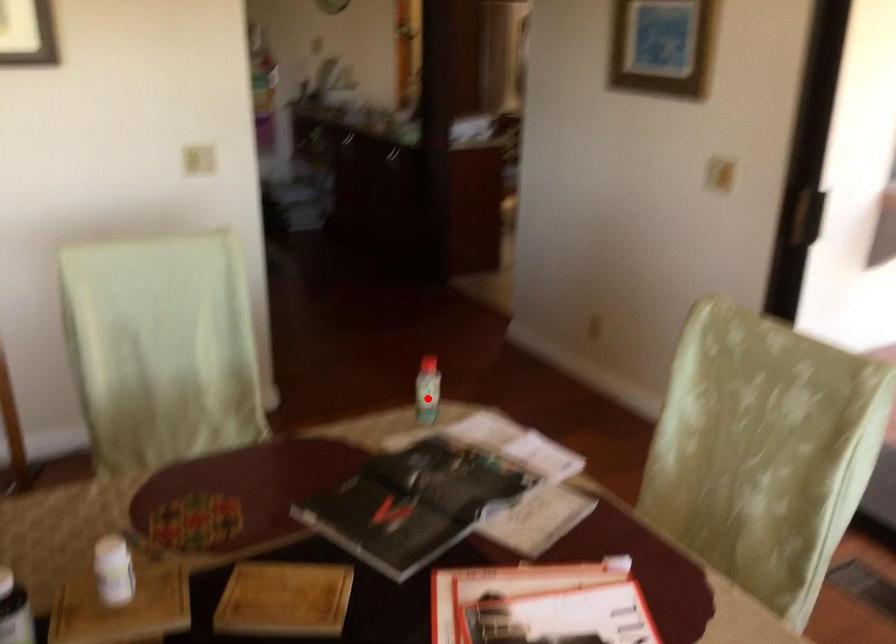
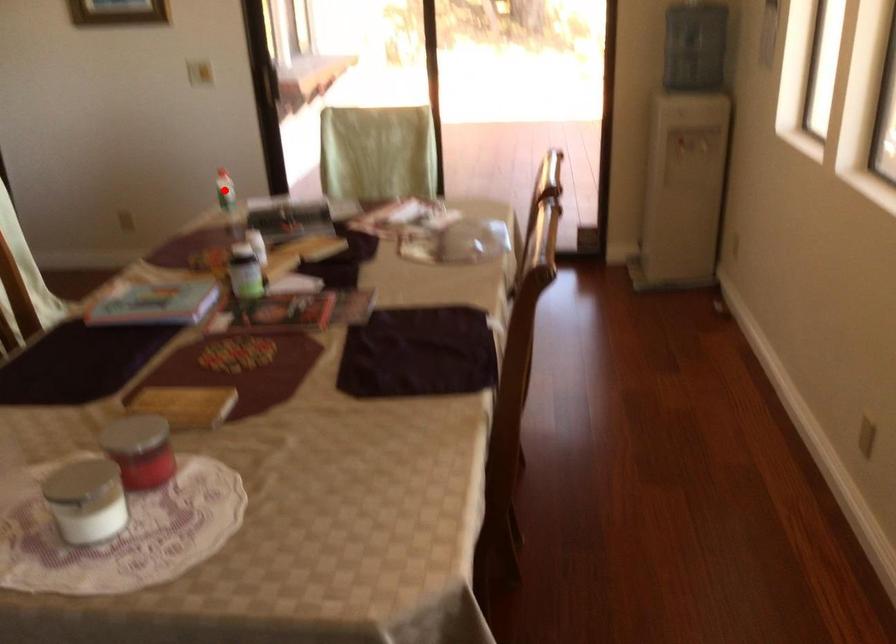
I am providing you with two images of the same scene from different viewpoints. A red point is marked on the first image and another point is marked on the second image. Is the red point in image1 aligned with the point shown in image2?

Yes